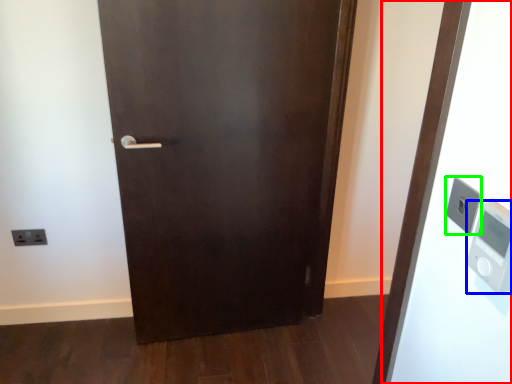
Question: Estimate the real-world distances between objects in this image. Which object is farther from elevator (highlighted by a red box), thermometer (highlighted by a blue box) or light switch (highlighted by a green box)?

Choices:
 (A) thermometer
 (B) light switch

Answer: (A)